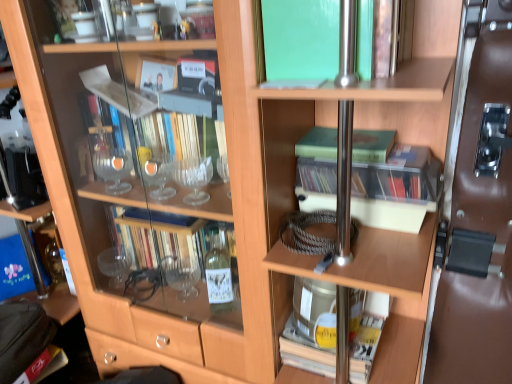
Question: Considering the relative sizes of leather handbag at lower left and brown leather door at right in the image provided, is leather handbag at lower left wider than brown leather door at right?

Choices:
 (A) yes
 (B) no

Answer: (A)

Question: From the image's perspective, is leather handbag at lower left on brown leather door at right?

Choices:
 (A) yes
 (B) no

Answer: (B)

Question: Is leather handbag at lower left surrounding brown leather door at right?

Choices:
 (A) yes
 (B) no

Answer: (B)

Question: Would you say leather handbag at lower left is a long distance from brown leather door at right?

Choices:
 (A) yes
 (B) no

Answer: (A)

Question: Is leather handbag at lower left at the left side of brown leather door at right?

Choices:
 (A) no
 (B) yes

Answer: (B)

Question: Does point (432, 339) appear closer or farther from the camera than point (312, 43)?

Choices:
 (A) closer
 (B) farther

Answer: (B)

Question: From a real-world perspective, is brown leather door at right above or below green matte book at upper center, acting as the 5th book starting from the bottom?

Choices:
 (A) above
 (B) below

Answer: (B)

Question: Looking at their shapes, would you say brown leather door at right is wider or thinner than green matte book at upper center, acting as the 5th book starting from the bottom?

Choices:
 (A) thin
 (B) wide

Answer: (A)

Question: From the image's perspective, relative to green matte book at upper center, acting as the 5th book starting from the bottom, is brown leather door at right above or below?

Choices:
 (A) above
 (B) below

Answer: (B)

Question: From a real-world perspective, is leather handbag at lower left above or below clear plastic case at center, the fourth book in the top-to-bottom sequence?

Choices:
 (A) above
 (B) below

Answer: (B)

Question: Is leather handbag at lower left bigger or smaller than clear plastic case at center, which appears as the second book when ordered from the bottom?

Choices:
 (A) small
 (B) big

Answer: (B)

Question: From the image's perspective, is leather handbag at lower left positioned above or below clear plastic case at center, the fourth book in the top-to-bottom sequence?

Choices:
 (A) above
 (B) below

Answer: (B)

Question: Considering their positions, is leather handbag at lower left located in front of or behind clear plastic case at center, which appears as the second book when ordered from the bottom?

Choices:
 (A) behind
 (B) front

Answer: (A)

Question: In the image, is brown leather door at right positioned in front of or behind green matte book at center, acting as the 2th book starting from the top?

Choices:
 (A) front
 (B) behind

Answer: (A)

Question: Is point (457, 132) closer or farther from the camera than point (311, 145)?

Choices:
 (A) closer
 (B) farther

Answer: (B)